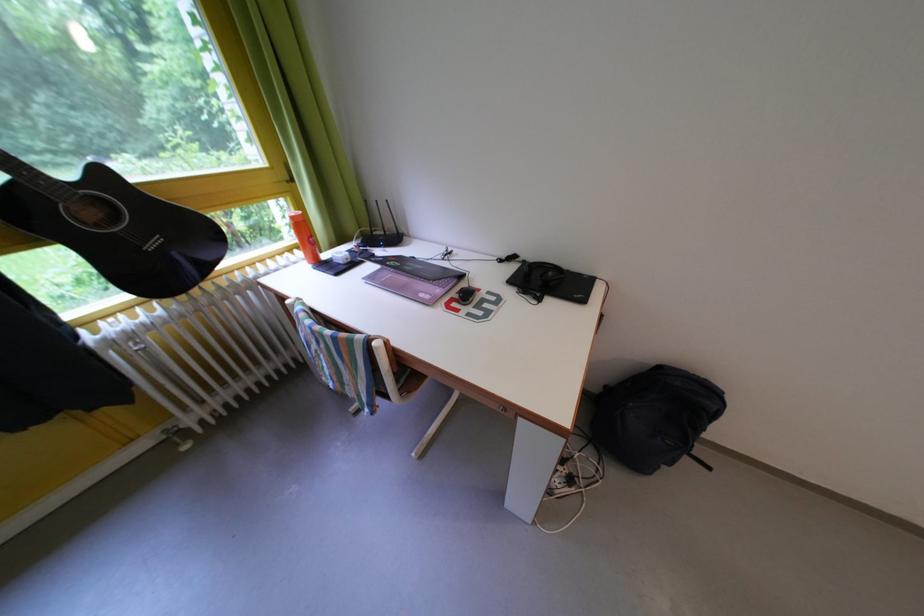
Where would you lift the black acoustic guitar? Please return your answer as a coordinate pair (x, y).

(114, 227)